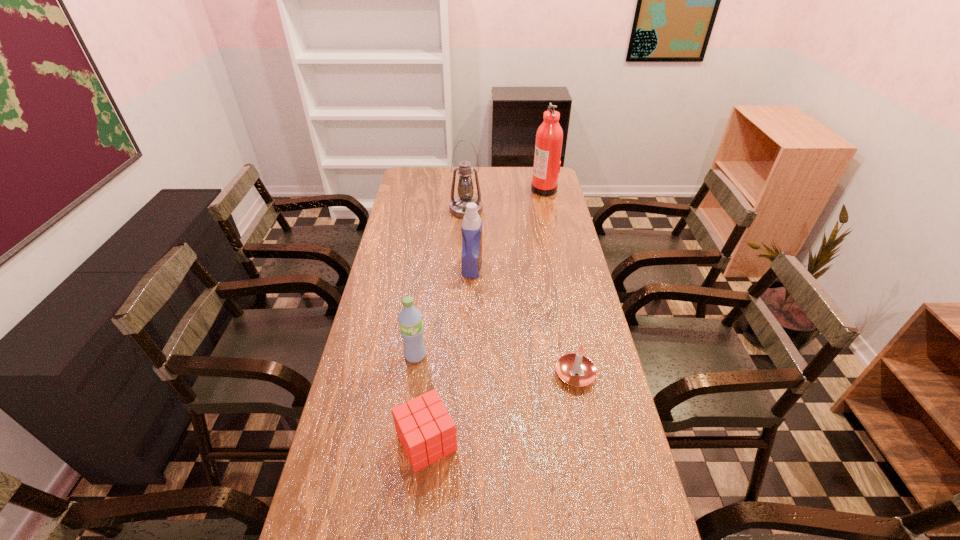
Find the location of a particular element. This screenshot has width=960, height=540. candle that is at the right edge is located at coordinates 568,365.

Where is `object present at the far right corner`? The width and height of the screenshot is (960, 540). object present at the far right corner is located at coordinates (549, 137).

In order to click on vacant space at the left edge in this screenshot , I will do `click(409, 279)`.

Locate an element on the screen. This screenshot has height=540, width=960. free spot at the right edge of the desktop is located at coordinates (546, 206).

This screenshot has height=540, width=960. I want to click on vacant space at the far left corner of the desktop, so click(x=417, y=190).

Locate an element on the screen. empty space that is in between the detergent and the fire extinguisher is located at coordinates (508, 228).

At what (x,y) coordinates should I click in order to perform the action: click on vacant point located between the fourth nearest object and the tallest object. Please return your answer as a coordinate pair (x, y). The width and height of the screenshot is (960, 540). Looking at the image, I should click on click(508, 228).

Identify the location of free space between the cube and the detergent. The image size is (960, 540). (449, 355).

Find the location of a particular element. The height and width of the screenshot is (540, 960). vacant area that lies between the fifth nearest object and the nearest object is located at coordinates (446, 326).

Find the location of a particular element. empty space between the second tallest object and the water bottle is located at coordinates (441, 282).